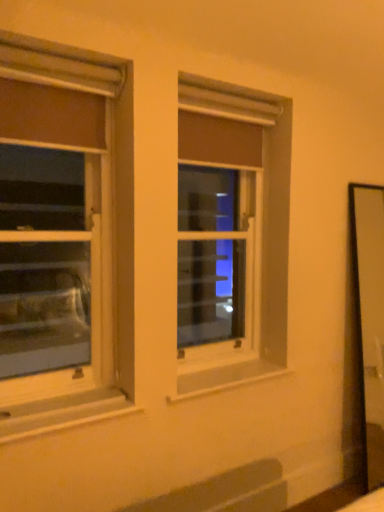
Question: Which direction should I rotate to look at clear glass window at center, marked as the 1th window in a back-to-front arrangement?

Choices:
 (A) left
 (B) right

Answer: (B)

Question: Does clear glass window at center, positioned as the 1th window in right-to-left order, have a larger size compared to white painted wood at lower left?

Choices:
 (A) yes
 (B) no

Answer: (A)

Question: Does clear glass window at center, arranged as the second window when viewed from the left, turn towards white painted wood at lower left?

Choices:
 (A) no
 (B) yes

Answer: (A)

Question: From a real-world perspective, is clear glass window at center, which is the second window from front to back, positioned over white painted wood at lower left based on gravity?

Choices:
 (A) no
 (B) yes

Answer: (B)

Question: From the image's perspective, is clear glass window at center, positioned as the 1th window in right-to-left order, below white painted wood at lower left?

Choices:
 (A) yes
 (B) no

Answer: (B)

Question: Can you see clear glass window at center, which is the second window from front to back, touching white painted wood at lower left?

Choices:
 (A) no
 (B) yes

Answer: (A)

Question: Is clear glass window at center, positioned as the 1th window in right-to-left order, not near white painted wood at lower left?

Choices:
 (A) no
 (B) yes

Answer: (A)

Question: Is matte white window at left, the 1th window from the front, positioned far away from clear glass window at center, which is the second window from front to back?

Choices:
 (A) yes
 (B) no

Answer: (A)

Question: Is matte white window at left, which is the 2th window in back-to-front order, oriented towards clear glass window at center, marked as the 1th window in a back-to-front arrangement?

Choices:
 (A) yes
 (B) no

Answer: (B)

Question: Can you confirm if matte white window at left, which is the 2th window in back-to-front order, is shorter than clear glass window at center, arranged as the second window when viewed from the left?

Choices:
 (A) yes
 (B) no

Answer: (A)

Question: From a real-world perspective, is matte white window at left, which is the 1th window from left to right, beneath clear glass window at center, which is the second window from front to back?

Choices:
 (A) no
 (B) yes

Answer: (A)

Question: Does matte white window at left, the 1th window from the front, have a lesser width compared to clear glass window at center, which is the second window from front to back?

Choices:
 (A) no
 (B) yes

Answer: (A)

Question: From the image's perspective, is matte white window at left, which is the 2th window in back-to-front order, on clear glass window at center, marked as the 1th window in a back-to-front arrangement?

Choices:
 (A) yes
 (B) no

Answer: (B)

Question: Is matte white window at left, which is the 2th window in back-to-front order, inside clear glass window at center, marked as the 1th window in a back-to-front arrangement?

Choices:
 (A) yes
 (B) no

Answer: (B)